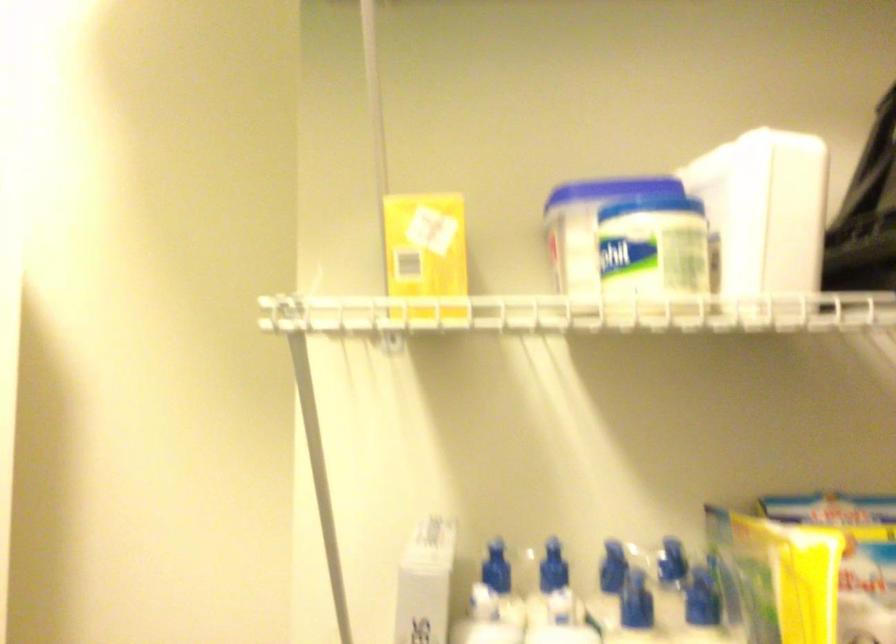
The image size is (896, 644). I want to click on white plastic tub, so click(x=763, y=212).